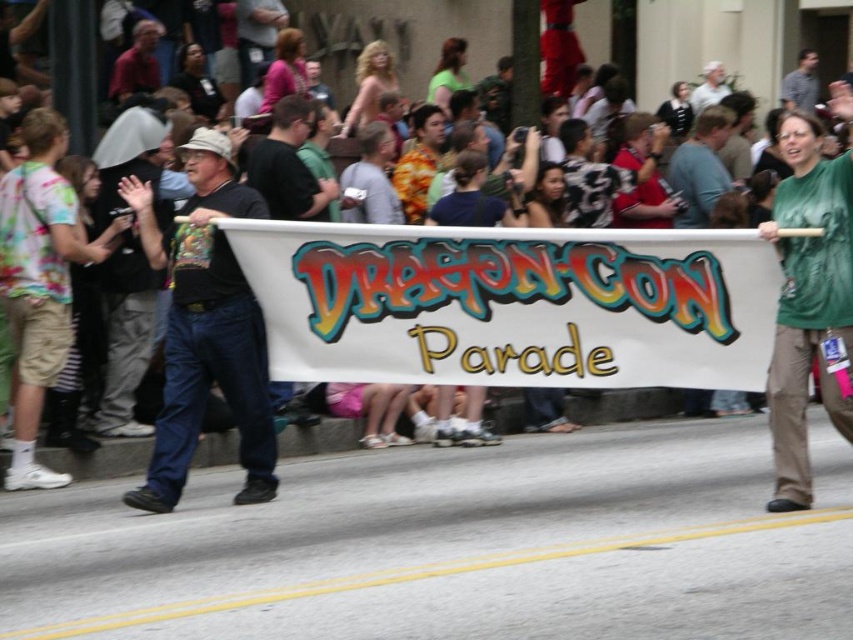
Question: Is black t-shirt at left to the left of green fabric shirt at center from the viewer's perspective?

Choices:
 (A) yes
 (B) no

Answer: (A)

Question: Can you confirm if green fabric shirt at center is positioned to the right of gray fabric hat at upper center?

Choices:
 (A) yes
 (B) no

Answer: (B)

Question: Which of the following is the closest to the observer?

Choices:
 (A) red shirt at upper left
 (B) green fabric shirt at center

Answer: (B)

Question: Does black t-shirt at left have a lesser width compared to red shirt at upper left?

Choices:
 (A) yes
 (B) no

Answer: (B)

Question: Which point appears closest to the camera in this image?

Choices:
 (A) (698, 108)
 (B) (144, 70)
 (C) (252, 202)
 (D) (830, 195)

Answer: (D)

Question: Which point appears closest to the camera in this image?

Choices:
 (A) (143, 28)
 (B) (817, 264)

Answer: (B)